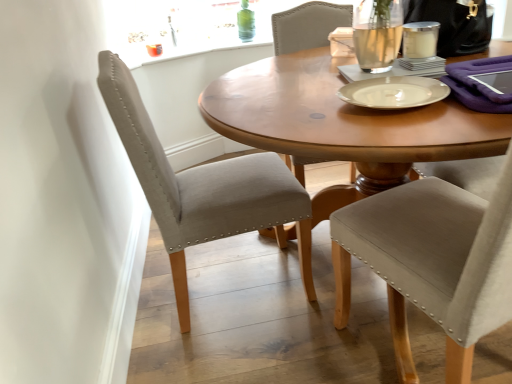
Question: In terms of size, does satin beige chair at upper right, the second chair from the left, appear bigger or smaller than satin beige chair at left, which ranks as the 1th chair in left-to-right order?

Choices:
 (A) small
 (B) big

Answer: (B)

Question: Is satin beige chair at upper right, the second chair from the left, wider or thinner than satin beige chair at left, which ranks as the 1th chair in left-to-right order?

Choices:
 (A) wide
 (B) thin

Answer: (B)

Question: Considering the real-world distances, which object is farthest from the clear glass candle at upper right, which ranks as the 2th tableware in bottom-to-top order?

Choices:
 (A) satin beige chair at upper right, the second chair from the left
 (B) satin beige chair at left, the second chair viewed from the right
 (C) white matte plate at center, acting as the 1th tableware starting from the front

Answer: (B)

Question: Estimate the real-world distances between objects in this image. Which object is closer to the white matte plate at center, placed as the first tableware when sorted from bottom to top?

Choices:
 (A) satin beige chair at left, which ranks as the 1th chair in left-to-right order
 (B) satin beige chair at upper right, the 1th chair when ordered from right to left
 (C) clear glass candle at upper right, marked as the second tableware in a left-to-right arrangement

Answer: (C)